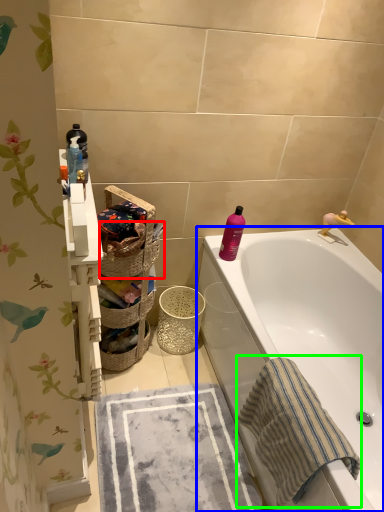
Question: Estimate the real-world distances between objects in this image. Which object is closer to basket (highlighted by a red box), bathtub (highlighted by a blue box) or beach towel (highlighted by a green box)?

Choices:
 (A) bathtub
 (B) beach towel

Answer: (A)